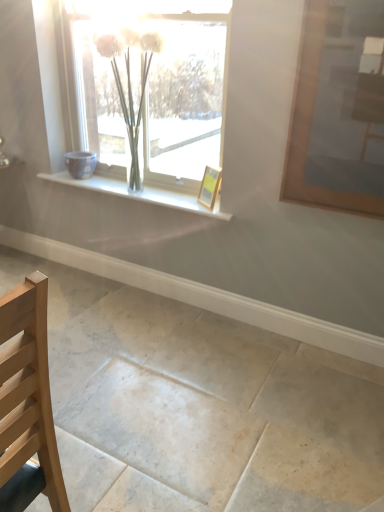
Where is `vacant space underneath wooden picture frame at upper right, marked as the 1th picture frame in a right-to-left arrangement (from a real-world perspective)`? vacant space underneath wooden picture frame at upper right, marked as the 1th picture frame in a right-to-left arrangement (from a real-world perspective) is located at coordinates (303, 343).